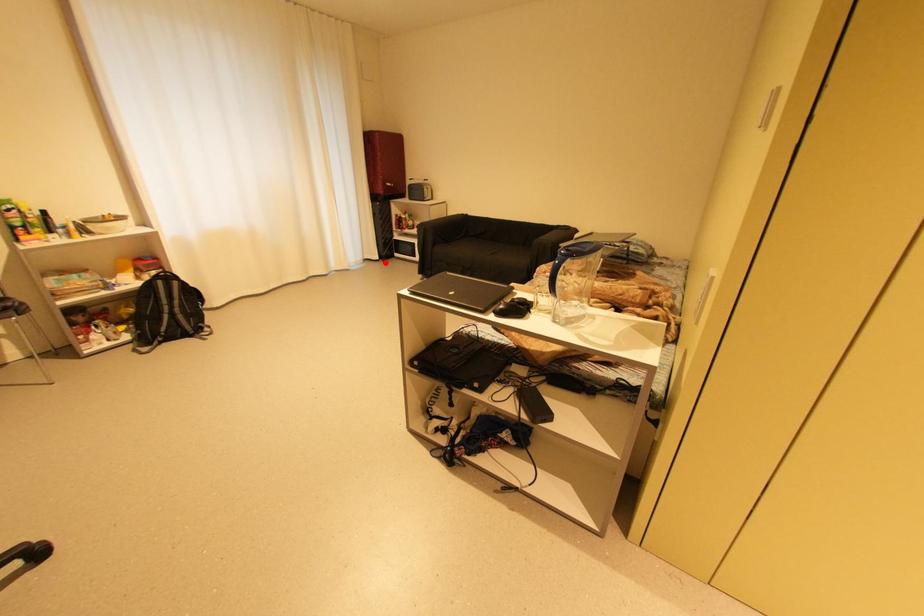
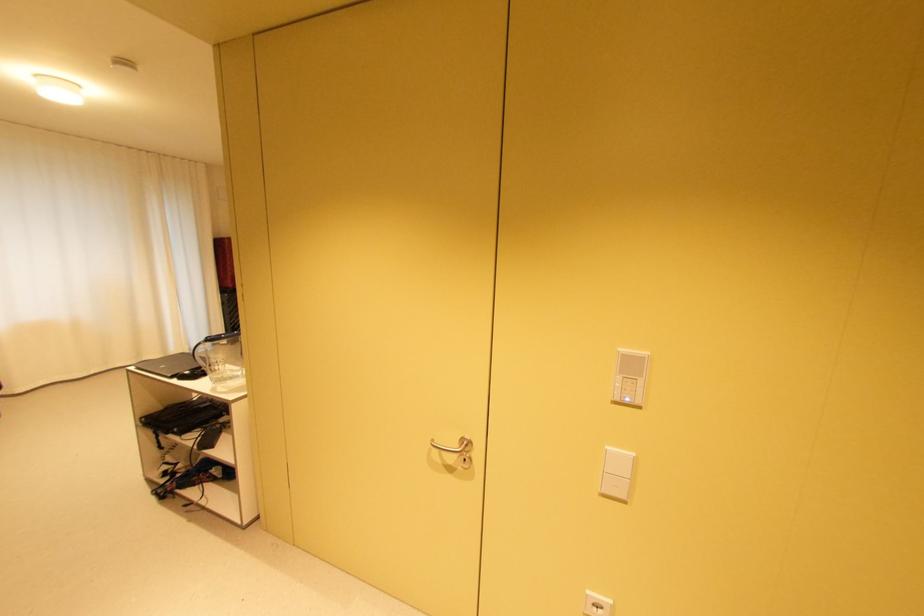
In the second image, find the point that corresponds to the highlighted location in the first image.

(234, 346)